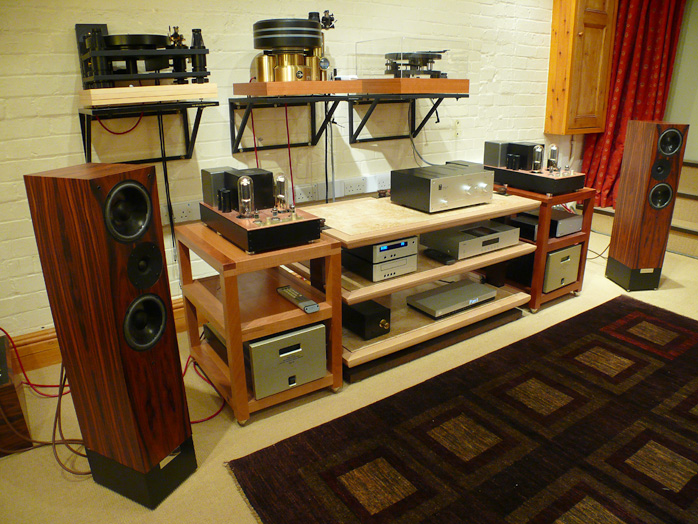
Where is `the right wall shelf`? Image resolution: width=698 pixels, height=524 pixels. the right wall shelf is located at coordinates (414, 87).